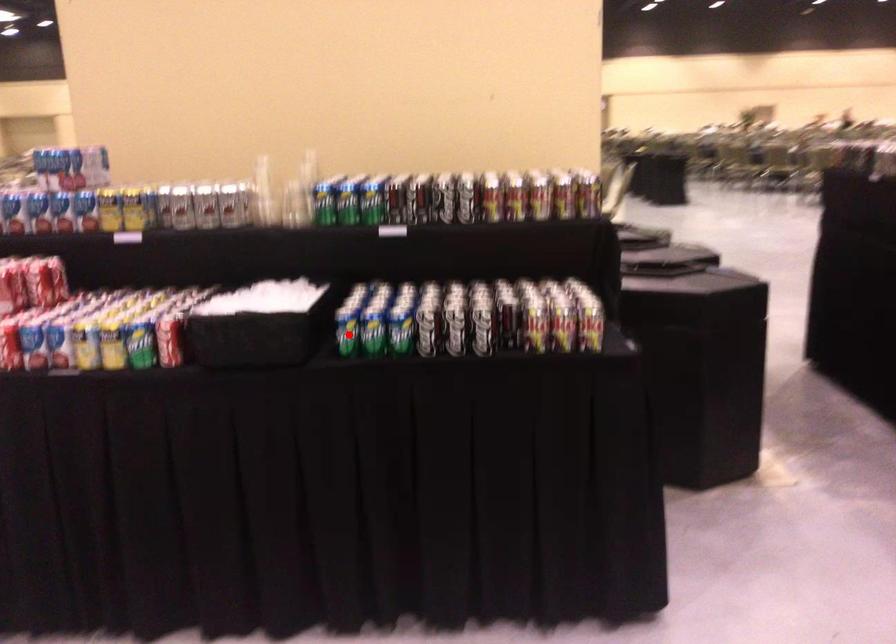
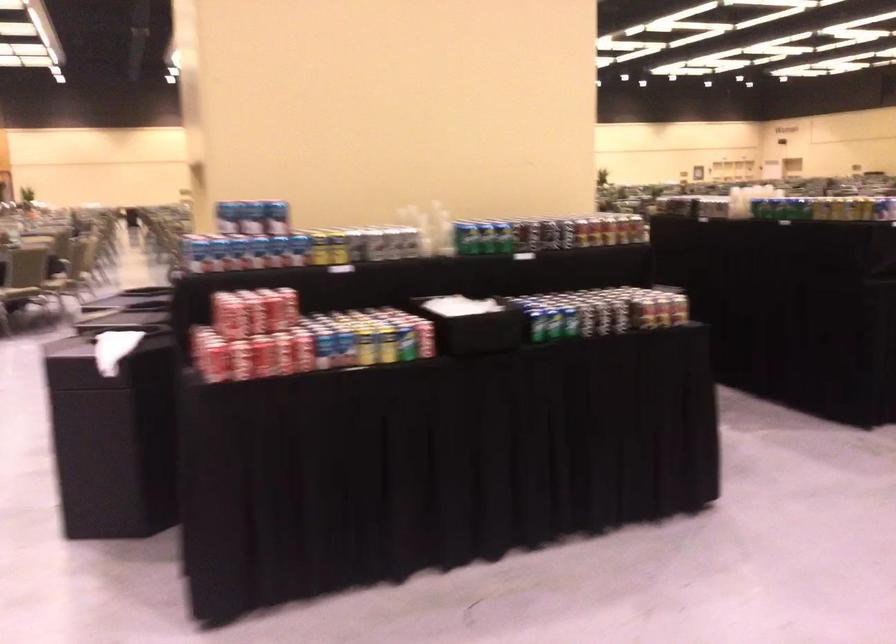
Question: I am providing you with two images of the same scene from different viewpoints. Image1 has a red point marked. In image2, the corresponding 3D location appears at what relative position? Reply with the corresponding letter.

Choices:
 (A) Closer
 (B) Farther

Answer: (B)